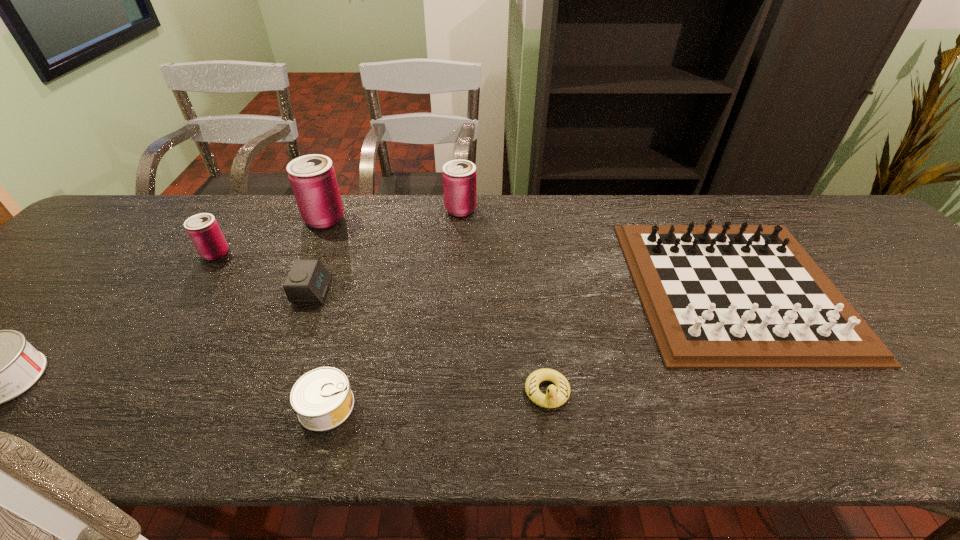
Image resolution: width=960 pixels, height=540 pixels. Identify the location of duckling situated at the near edge. (556, 396).

At what (x,y) coordinates should I click in order to perform the action: click on can positioned at the near edge. Please return your answer as a coordinate pair (x, y). The width and height of the screenshot is (960, 540). Looking at the image, I should click on (322, 398).

The image size is (960, 540). What are the coordinates of `vacant space at the far edge of the desktop` in the screenshot? It's located at (427, 226).

The image size is (960, 540). Identify the location of free space at the near edge of the desktop. (852, 408).

In the image, there is a desktop. Find the location of `blank space at the left edge`. blank space at the left edge is located at coordinates (36, 318).

The height and width of the screenshot is (540, 960). I want to click on empty location between the duckling and the third object from right to left, so click(x=504, y=301).

The height and width of the screenshot is (540, 960). What are the coordinates of `free space between the gameboard and the third object from right to left` in the screenshot? It's located at (597, 248).

Where is `free spot between the third nearest can and the tallest can`? free spot between the third nearest can and the tallest can is located at coordinates (270, 236).

Identify the location of empty location between the fourth shortest can and the tallest object. (x=393, y=214).

Where is `free space between the second object from right to left and the alarm clock`? This screenshot has width=960, height=540. free space between the second object from right to left and the alarm clock is located at coordinates (430, 341).